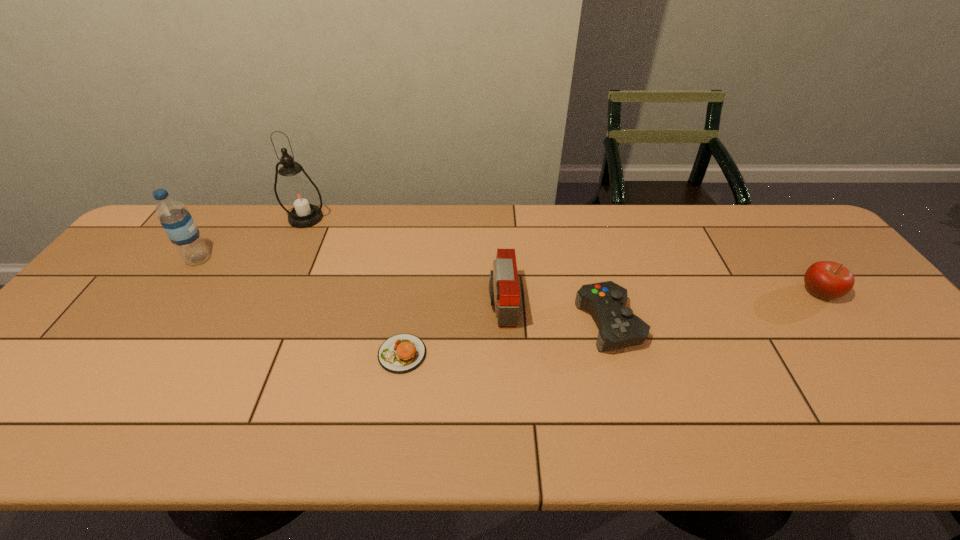
Where is `the second object from left to right`? The height and width of the screenshot is (540, 960). the second object from left to right is located at coordinates (298, 195).

In order to click on the tallest object in this screenshot , I will do `click(298, 195)`.

The height and width of the screenshot is (540, 960). Find the location of `water bottle`. water bottle is located at coordinates (177, 222).

The width and height of the screenshot is (960, 540). I want to click on the leftmost object, so click(177, 222).

Locate an element on the screen. the fourth shortest object is located at coordinates (504, 293).

The height and width of the screenshot is (540, 960). Find the location of `the third object from right to left`. the third object from right to left is located at coordinates (504, 293).

The height and width of the screenshot is (540, 960). Identify the location of apple. (828, 280).

Find the location of a particular element. The width and height of the screenshot is (960, 540). the third shortest object is located at coordinates (828, 280).

The height and width of the screenshot is (540, 960). Find the location of `the second object from right to left`. the second object from right to left is located at coordinates (618, 327).

At what (x,y) coordinates should I click in order to perform the action: click on control. Please return your answer as a coordinate pair (x, y). The height and width of the screenshot is (540, 960). Looking at the image, I should click on (618, 327).